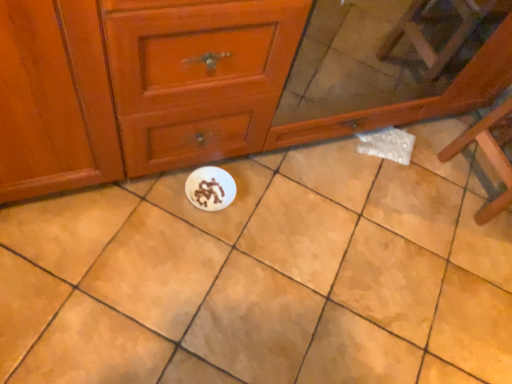
Question: Is point (58, 339) positioned closer to the camera than point (206, 29)?

Choices:
 (A) closer
 (B) farther

Answer: (B)

Question: Is white glossy plate at center wider or thinner than matte wood chest of drawers at center?

Choices:
 (A) wide
 (B) thin

Answer: (A)

Question: Which object is the closest to the matte wood chest of drawers at center?

Choices:
 (A) white matte paper plate at center
 (B) white glossy plate at center
 (C) wooden chair at right

Answer: (B)

Question: Considering the real-world distances, which object is closest to the white glossy plate at center?

Choices:
 (A) matte wood chest of drawers at center
 (B) white matte paper plate at center
 (C) wooden chair at right

Answer: (B)